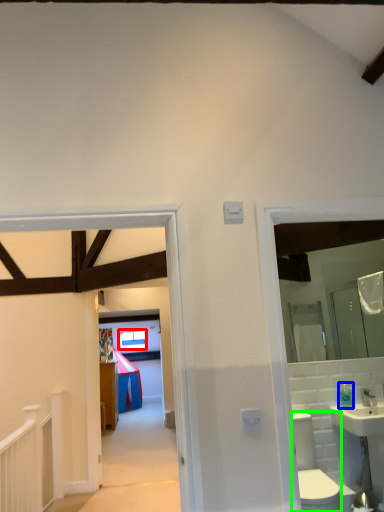
Question: Considering the real-world distances, which object is farthest from window (highlighted by a red box)? toiletry (highlighted by a blue box) or toilet bowl (highlighted by a green box)?

Choices:
 (A) toiletry
 (B) toilet bowl

Answer: (B)